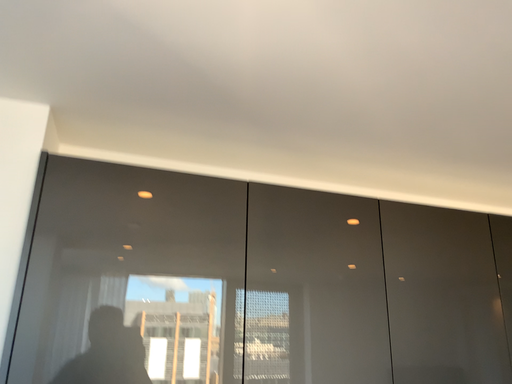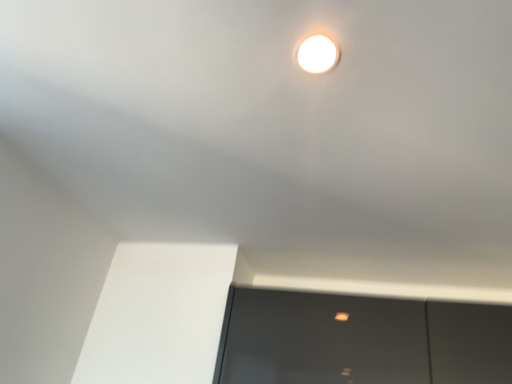
Question: How did the camera likely rotate when shooting the video?

Choices:
 (A) rotated upward
 (B) rotated downward

Answer: (A)